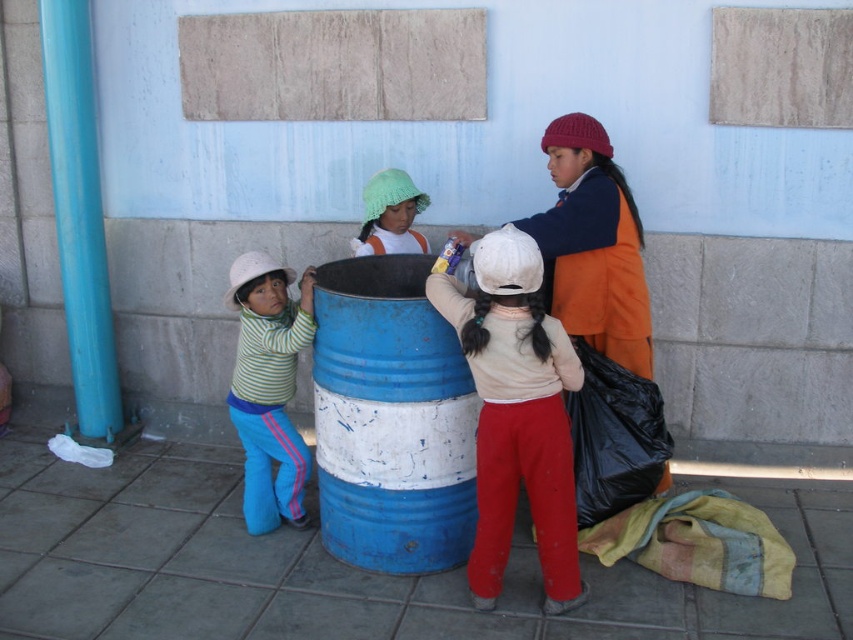
Does striped cotton shirt at left have a greater height compared to knitted green hat at center?

Yes, striped cotton shirt at left is taller than knitted green hat at center.

Can you confirm if striped cotton shirt at left is positioned to the left of knitted green hat at center?

Indeed, striped cotton shirt at left is positioned on the left side of knitted green hat at center.

The width and height of the screenshot is (853, 640). I want to click on striped cotton shirt at left, so click(x=268, y=387).

Can you confirm if matte white hat at center is positioned to the right of striped cotton shirt at left?

Correct, you'll find matte white hat at center to the right of striped cotton shirt at left.

The width and height of the screenshot is (853, 640). Find the location of `matte white hat at center`. matte white hat at center is located at coordinates (515, 413).

Can you confirm if blue painted metal barrel at center is wider than striped cotton shirt at left?

Yes, blue painted metal barrel at center is wider than striped cotton shirt at left.

Looking at this image, can you confirm if blue painted metal barrel at center is bigger than striped cotton shirt at left?

Yes.

Measure the distance between point (410, 358) and camera.

3.16 meters

You are a GUI agent. You are given a task and a screenshot of the screen. Output one action in this format:
    pyautogui.click(x=<x>, y=<y>)
    Task: Click on the blue painted metal barrel at center
    The height and width of the screenshot is (640, 853).
    Given the screenshot: What is the action you would take?
    pyautogui.click(x=392, y=419)